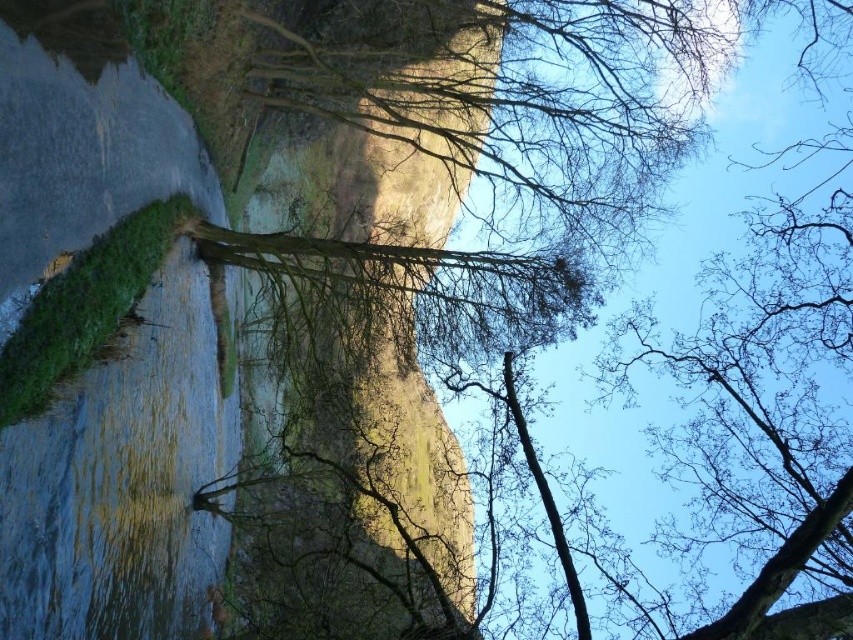
You are standing at the edge of the water in the image. The point labeled as point (352, 328) is a rustic stone cliff at center. Can you see the rustic stone cliff at center from your current position?

Yes, the point (352, 328) indicates the rustic stone cliff at center, so you can see it from the edge of the water where you are standing.

You are a hiker trying to cross the river. You see the rustic stone cliff at center and the smooth rock cliff at left. Which cliff is closer to you as you stand on the bank?

The rustic stone cliff at center is closer to you because the smooth rock cliff at left is behind it.

You are a hiker planning to cross from the smooth rock cliff at left to the rustic stone cliff at center. Given the terrain described, is there a direct path between them, or will you need to go around?

The rustic stone cliff at center is located above the smooth rock cliff at left, so there is a direct path between them as the smooth rock cliff at left is below and the rustic stone cliff at center is above.